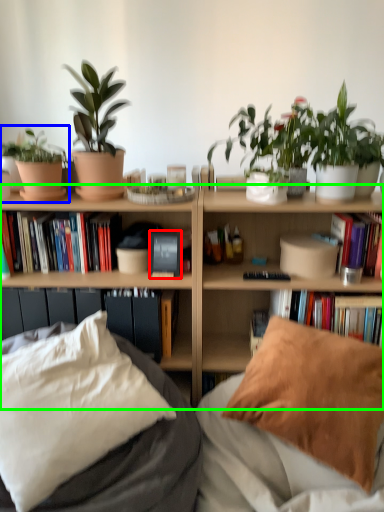
Question: Which object is the closest to the paperback book (highlighted by a red box)? Choose among these: houseplant (highlighted by a blue box) or bookcase (highlighted by a green box).

Choices:
 (A) houseplant
 (B) bookcase

Answer: (B)